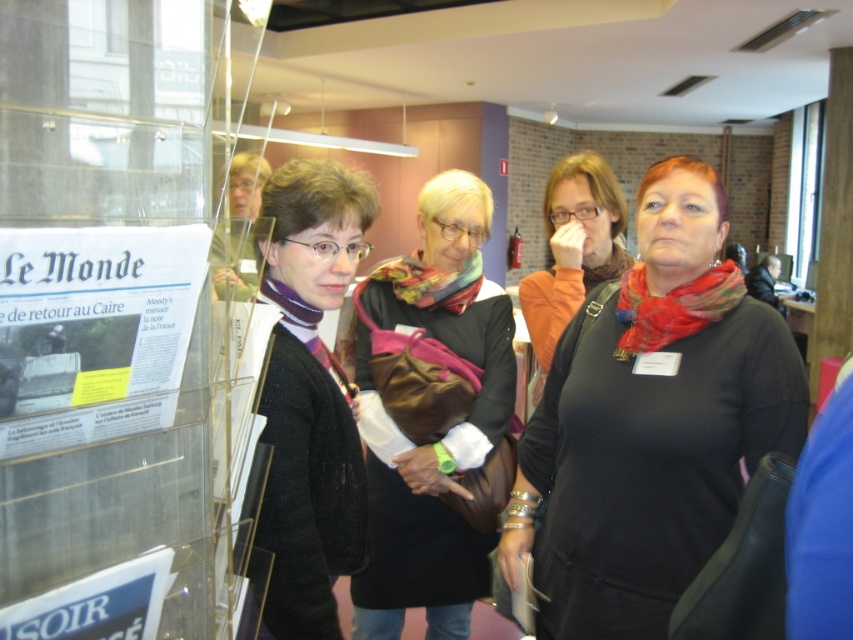
Is matte black shirt at center thinner than matte brown purse at center?

Incorrect, matte black shirt at center's width is not less than matte brown purse at center's.

Is matte black shirt at center bigger than matte brown purse at center?

Incorrect, matte black shirt at center is not larger than matte brown purse at center.

Looking at this image, who is more distant from viewer, (686, 173) or (479, 540)?

Point (479, 540)

Locate an element on the screen. matte black shirt at center is located at coordinates (650, 422).

Which of these two, matte black scarf at center or blue paper poster at lower left, stands taller?

With more height is matte black scarf at center.

Is matte black scarf at center behind blue paper poster at lower left?

That is True.

Is point (563, 192) farther from camera compared to point (136, 621)?

Yes, it is behind point (136, 621).

Find the location of a particular element. Image resolution: width=853 pixels, height=640 pixels. matte black scarf at center is located at coordinates (573, 250).

Does matte brown purse at center lie in front of matte black scarf at center?

Yes, it is in front of matte black scarf at center.

Does point (488, 392) come closer to viewer compared to point (616, 227)?

Yes.

Find the location of a particular element. The height and width of the screenshot is (640, 853). matte brown purse at center is located at coordinates (433, 417).